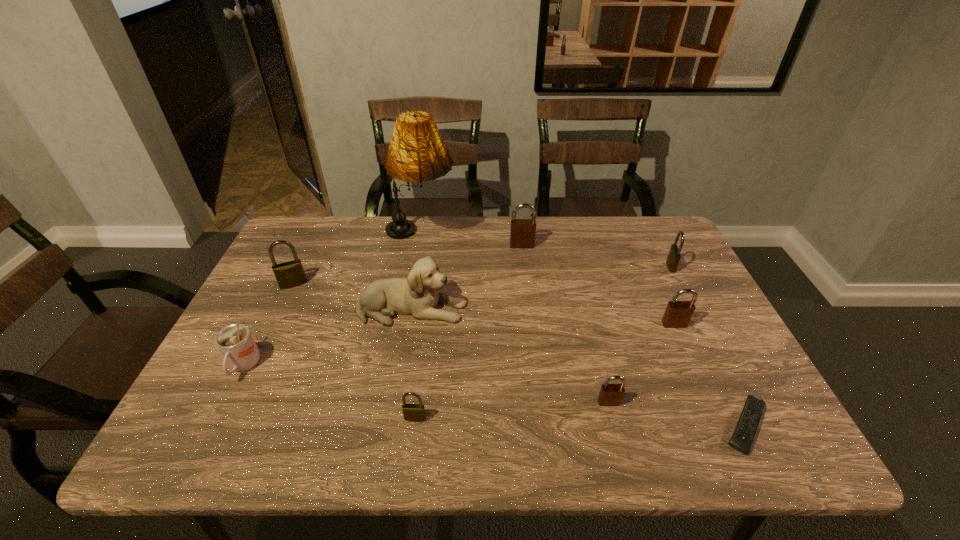
Where is `cup that is at the left edge`? cup that is at the left edge is located at coordinates 235,342.

At what (x,y) coordinates should I click in order to perform the action: click on remote control present at the right edge. Please return your answer as a coordinate pair (x, y). The image size is (960, 540). Looking at the image, I should click on (744, 434).

I want to click on object located in the far right corner section of the desktop, so click(x=674, y=255).

Identify the location of object positioned at the near right corner. The image size is (960, 540). (744, 434).

Image resolution: width=960 pixels, height=540 pixels. In the image, there is a desktop. What are the coordinates of `vacant space at the far edge` in the screenshot? It's located at (414, 259).

Identify the location of free space at the near edge. The image size is (960, 540). (396, 422).

Where is `free space at the left edge of the desktop`? Image resolution: width=960 pixels, height=540 pixels. free space at the left edge of the desktop is located at coordinates (x=300, y=325).

Identify the location of vacant area at the right edge. The image size is (960, 540). (656, 293).

You are a GUI agent. You are given a task and a screenshot of the screen. Output one action in this format:
    pyautogui.click(x=<x>, y=<y>)
    Task: Click on the vacant space at the far left corner of the desktop
    
    Given the screenshot: What is the action you would take?
    (x=300, y=249)

The image size is (960, 540). Find the location of `vacant position at the far right corner of the desktop`. vacant position at the far right corner of the desktop is located at coordinates (635, 232).